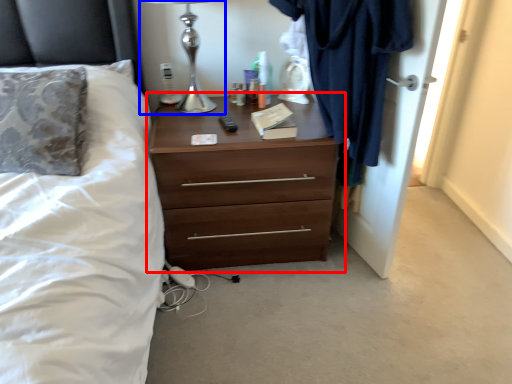
Question: Which point is further to the camera, chest of drawers (highlighted by a red box) or table lamp (highlighted by a blue box)?

Choices:
 (A) chest of drawers
 (B) table lamp

Answer: (A)